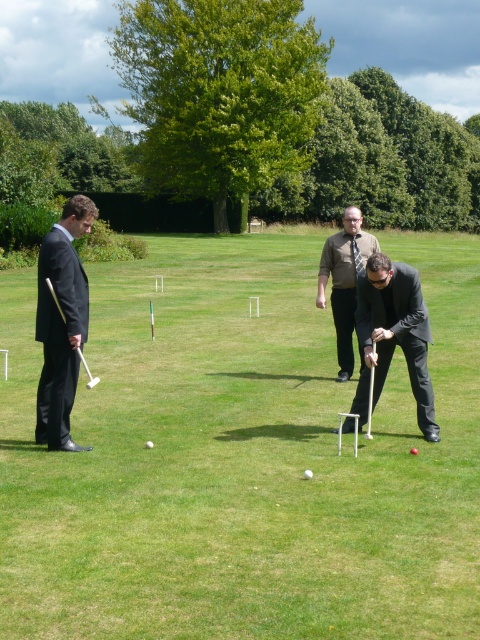
Does green grass at center appear on the right side of black glossy suit at center?

Indeed, green grass at center is positioned on the right side of black glossy suit at center.

From the picture: Is green grass at center smaller than black glossy suit at center?

No, green grass at center is not smaller than black glossy suit at center.

Which is behind, point (264, 330) or point (419, 420)?

The point (264, 330) is behind.

This screenshot has width=480, height=640. What are the coordinates of `green grass at center` in the screenshot? It's located at (240, 458).

Between green grass at center and brown textured shirt at center, which one is positioned lower?

green grass at center is lower down.

Who is more distant from viewer, (x=180, y=428) or (x=360, y=362)?

Point (x=360, y=362)

At what (x,y) coordinates should I click in order to perform the action: click on green grass at center. Please return your answer as a coordinate pair (x, y). This screenshot has height=640, width=480. Looking at the image, I should click on (240, 458).

This screenshot has width=480, height=640. Find the location of `green grass at center`. green grass at center is located at coordinates (240, 458).

How far apart are matte black suit at left and brown textured shirt at center?

matte black suit at left is 3.34 meters from brown textured shirt at center.

Between matte black suit at left and brown textured shirt at center, which one is positioned higher?

brown textured shirt at center is higher up.

At what (x,y) coordinates should I click in order to perform the action: click on matte black suit at left. Please return your answer as a coordinate pair (x, y). Image resolution: width=480 pixels, height=640 pixels. Looking at the image, I should click on (61, 323).